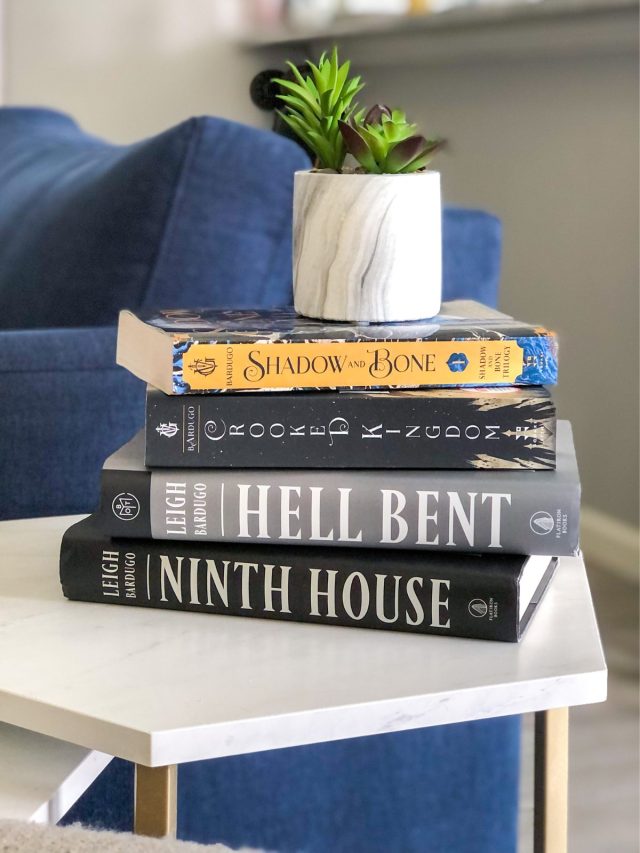
Locate an element on the screen. The image size is (640, 853). black book is located at coordinates (88, 543).